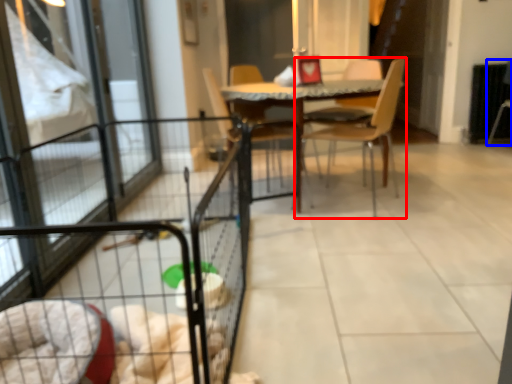
Question: Among these objects, which one is nearest to the camera, chair (highlighted by a red box) or armchair (highlighted by a blue box)?

Choices:
 (A) chair
 (B) armchair

Answer: (A)